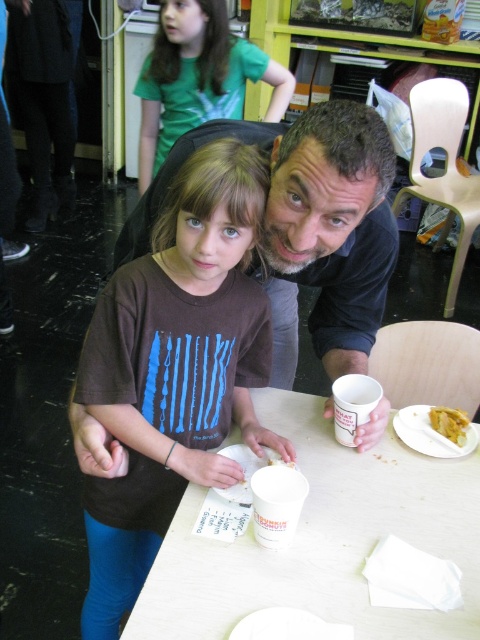
You are standing in front of the table where the young girl and the adult male are. You want to place a small gift on the table. The gift needs to be placed closer to you. Which point should you choose between point (408, 499) and point (275, 81)?

Point (408, 499) is closer to the viewer than point (275, 81), so you should place the gift on point (408, 499) to have it closer to you.